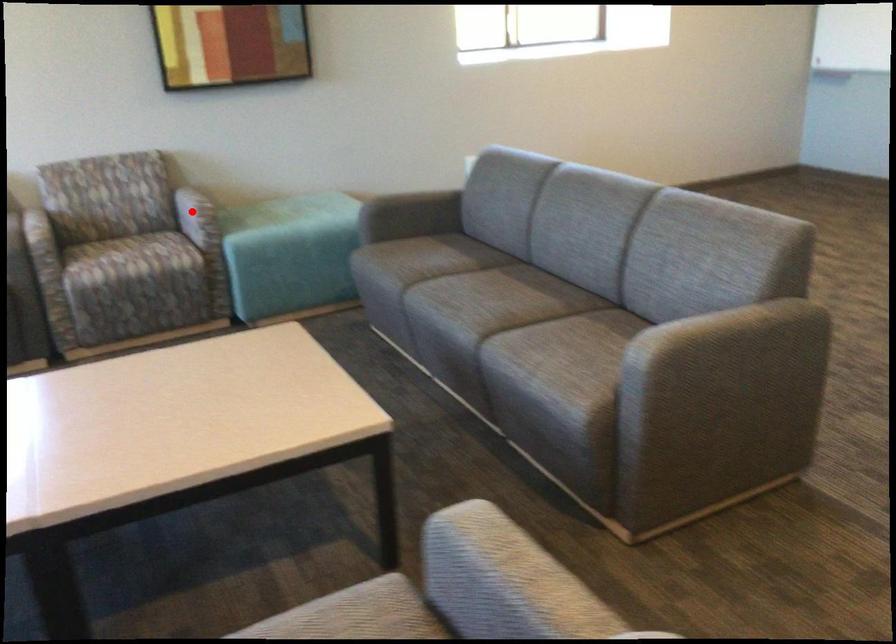
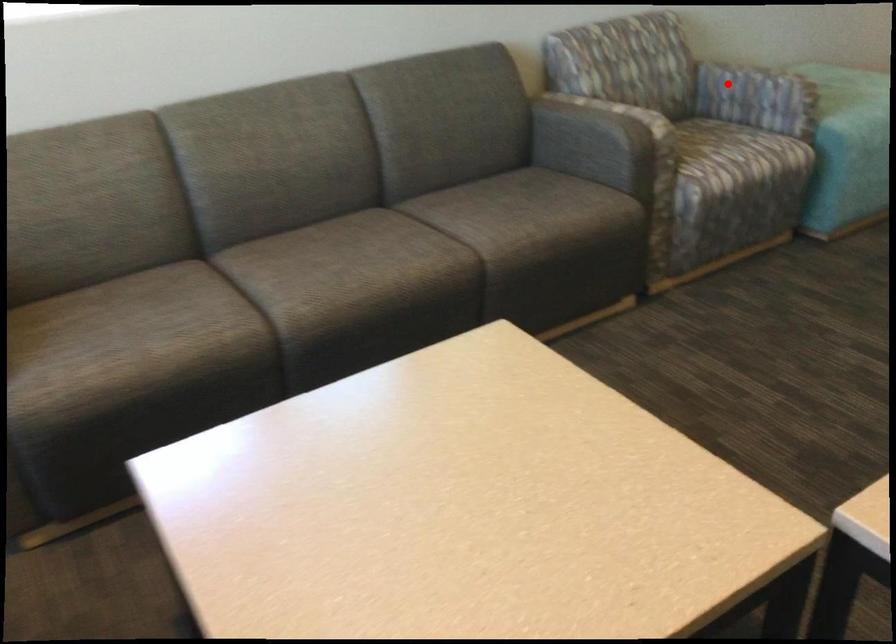
I am providing you with two images of the same scene from different viewpoints. A red point is marked on the first image and another point is marked on the second image. Is the red point in image1 aligned with the point shown in image2?

Yes